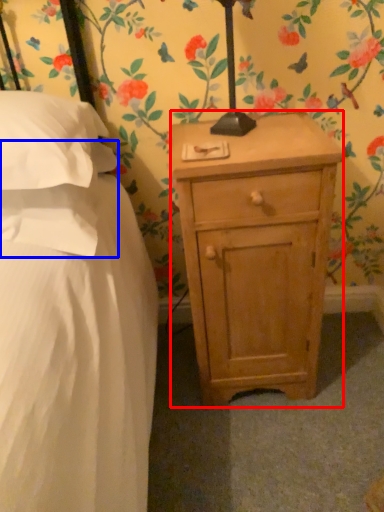
Question: Which point is further to the camera, nightstand (highlighted by a red box) or pillow (highlighted by a blue box)?

Choices:
 (A) nightstand
 (B) pillow

Answer: (A)